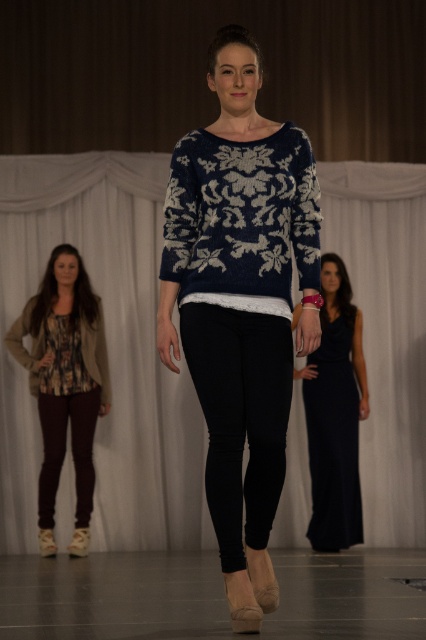
Is the position of printed fabric blouse at left more distant than that of velvet black dress at right?

No, it is in front of velvet black dress at right.

Can you confirm if printed fabric blouse at left is shorter than velvet black dress at right?

No, printed fabric blouse at left is not shorter than velvet black dress at right.

Is point (34, 310) positioned behind point (345, 512)?

That is True.

Locate an element on the screen. This screenshot has height=640, width=426. printed fabric blouse at left is located at coordinates (65, 384).

Does navy knit sweater at center lie in front of velvet black dress at right?

Yes.

Describe the element at coordinates (241, 304) in the screenshot. I see `navy knit sweater at center` at that location.

Between point (210, 152) and point (359, 413), which one is positioned behind?

The point (359, 413) is more distant.

The width and height of the screenshot is (426, 640). Identify the location of navy knit sweater at center. (241, 304).

Is navy blue knitted sweater at center bigger than floral print jersey at lower left?

Correct, navy blue knitted sweater at center is larger in size than floral print jersey at lower left.

How much distance is there between navy blue knitted sweater at center and floral print jersey at lower left?

A distance of 3.28 meters exists between navy blue knitted sweater at center and floral print jersey at lower left.

Who is more forward, (229,182) or (40,339)?

Point (229,182) is in front.

The height and width of the screenshot is (640, 426). I want to click on navy blue knitted sweater at center, so click(241, 214).